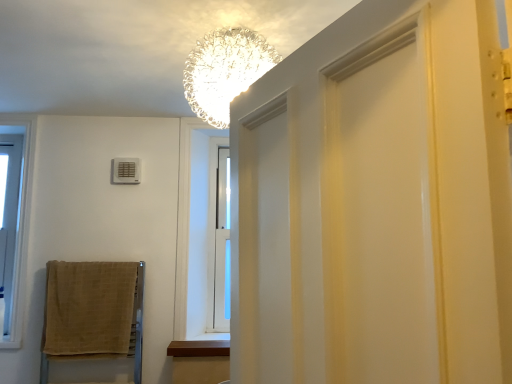
Where is `blank space situated above beige woven towel at lower left (from a real-world perspective)`? Image resolution: width=512 pixels, height=384 pixels. blank space situated above beige woven towel at lower left (from a real-world perspective) is located at coordinates (87, 263).